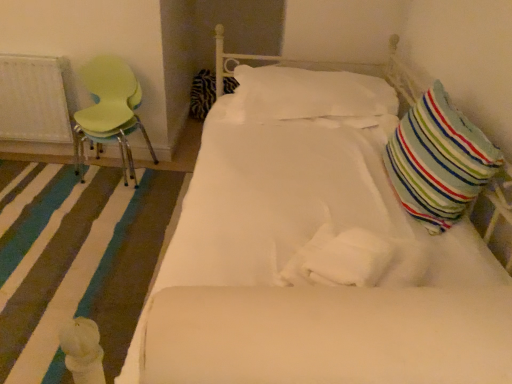
Question: Is zebra-patterned fabric pillow at center-left, placed as the 3th pillow when sorted from right to left, next to white soft pillow at center, the 2th pillow positioned from the right, and touching it?

Choices:
 (A) yes
 (B) no

Answer: (B)

Question: Is the position of zebra-patterned fabric pillow at center-left, which ranks as the first pillow in back-to-front order, more distant than that of white soft pillow at center, which appears as the 2th pillow when viewed from the front?

Choices:
 (A) no
 (B) yes

Answer: (B)

Question: From a real-world perspective, is zebra-patterned fabric pillow at center-left, the third pillow from the front, physically above white soft pillow at center, which appears as the 2th pillow when viewed from the front?

Choices:
 (A) no
 (B) yes

Answer: (A)

Question: Is zebra-patterned fabric pillow at center-left, the third pillow from the front, wider than white soft pillow at center, which is the 2th pillow in back-to-front order?

Choices:
 (A) no
 (B) yes

Answer: (A)

Question: Is zebra-patterned fabric pillow at center-left, which ranks as the first pillow in back-to-front order, not within white soft pillow at center, which appears as the 2th pillow when viewed from the front?

Choices:
 (A) no
 (B) yes

Answer: (B)

Question: From the image's perspective, would you say zebra-patterned fabric pillow at center-left, the third pillow from the front, is positioned over white soft pillow at center, which is the 2th pillow in back-to-front order?

Choices:
 (A) no
 (B) yes

Answer: (B)

Question: Does white soft pillow at center, which is the 2th pillow from left to right, have a lesser height compared to zebra-patterned fabric pillow at center-left, which is counted as the first pillow, starting from the left?

Choices:
 (A) no
 (B) yes

Answer: (B)

Question: Can you confirm if white soft pillow at center, which is the 2th pillow from left to right, is smaller than zebra-patterned fabric pillow at center-left, the third pillow from the front?

Choices:
 (A) yes
 (B) no

Answer: (B)

Question: Is white soft pillow at center, which is the 2th pillow in back-to-front order, not near zebra-patterned fabric pillow at center-left, which is counted as the first pillow, starting from the left?

Choices:
 (A) no
 (B) yes

Answer: (B)

Question: From the image's perspective, is white soft pillow at center, which appears as the 2th pillow when viewed from the front, located beneath zebra-patterned fabric pillow at center-left, placed as the 3th pillow when sorted from right to left?

Choices:
 (A) no
 (B) yes

Answer: (B)

Question: Is white soft pillow at center, the 2th pillow positioned from the right, bigger than zebra-patterned fabric pillow at center-left, placed as the 3th pillow when sorted from right to left?

Choices:
 (A) no
 (B) yes

Answer: (B)

Question: Is white soft pillow at center, the 2th pillow positioned from the right, aimed at zebra-patterned fabric pillow at center-left, the third pillow from the front?

Choices:
 (A) yes
 (B) no

Answer: (B)

Question: Does light green plastic chair at left have a smaller size compared to striped fabric pillow at right, the 3th pillow when ordered from left to right?

Choices:
 (A) yes
 (B) no

Answer: (B)